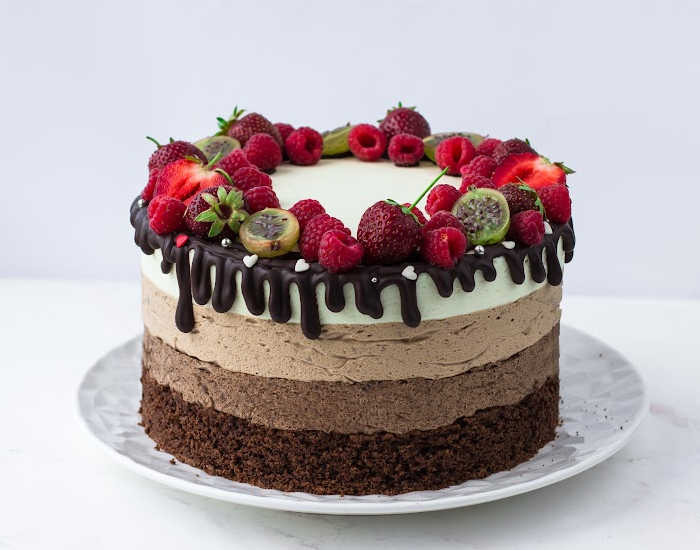
Image resolution: width=700 pixels, height=550 pixels. In order to click on table in this screenshot , I will do `click(64, 504)`.